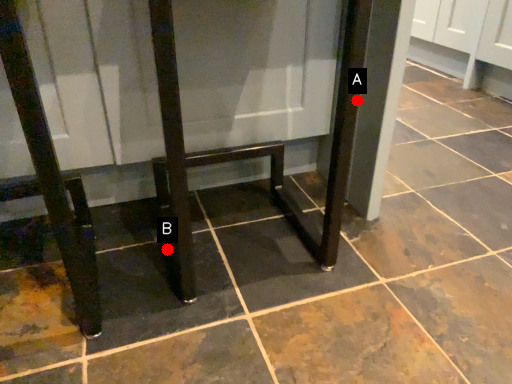
Question: Two points are circled on the image, labeled by A and B beside each circle. Which point appears closest to the camera in this image?

Choices:
 (A) A is closer
 (B) B is closer

Answer: (A)